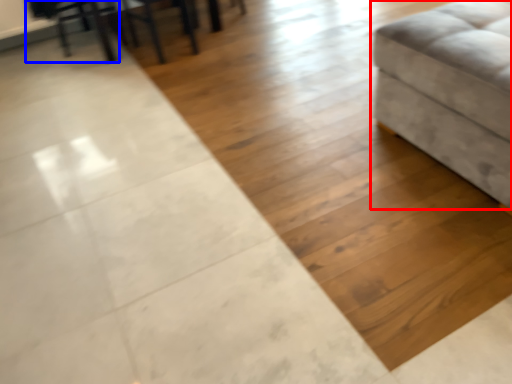
Question: Among these objects, which one is farthest to the camera, furniture (highlighted by a red box) or swivel chair (highlighted by a blue box)?

Choices:
 (A) furniture
 (B) swivel chair

Answer: (B)